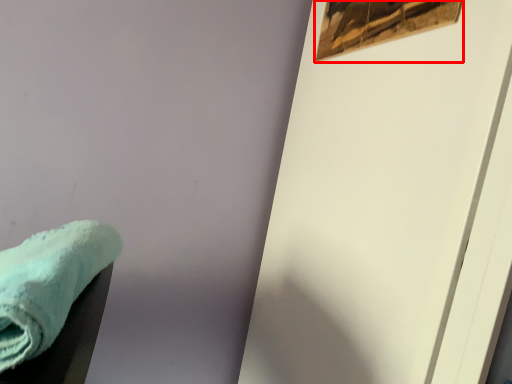
Question: From the image's perspective, where is picture frame (annotated by the red box) located in relation to towel in the image?

Choices:
 (A) above
 (B) below

Answer: (A)